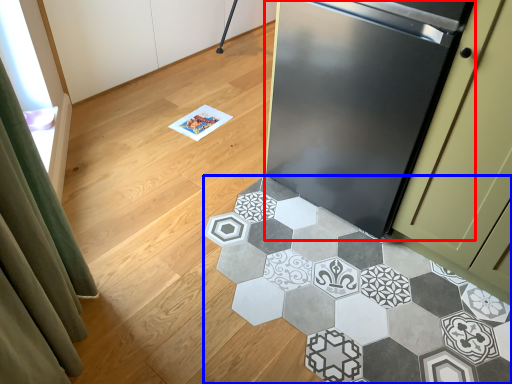
Question: Which object appears closest to the camera in this image, refrigerator (highlighted by a red box) or marble (highlighted by a blue box)?

Choices:
 (A) refrigerator
 (B) marble

Answer: (B)